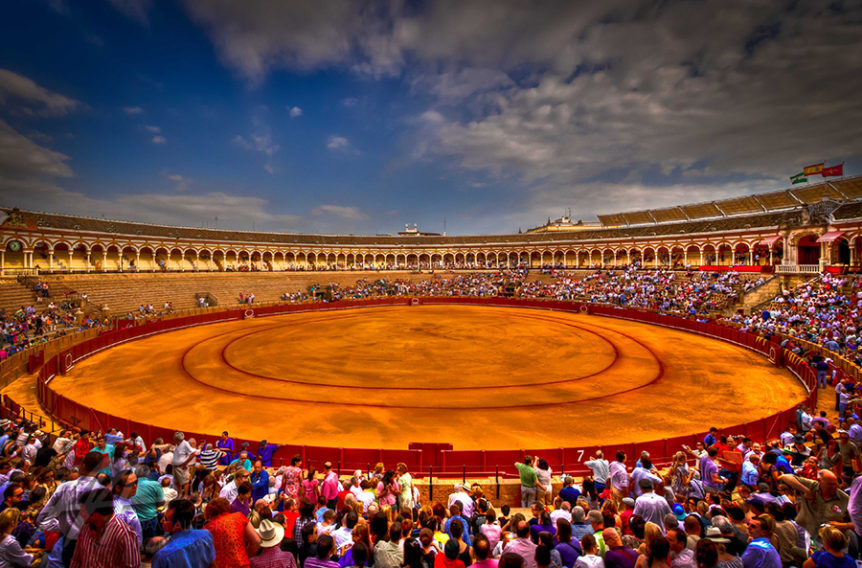
Image resolution: width=862 pixels, height=568 pixels. I want to click on stands, so point(157,287).